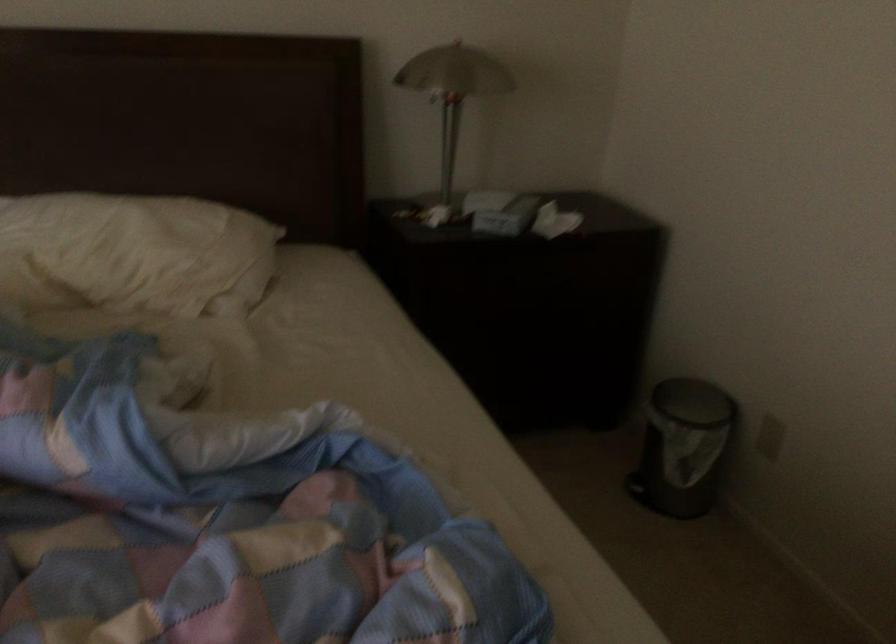
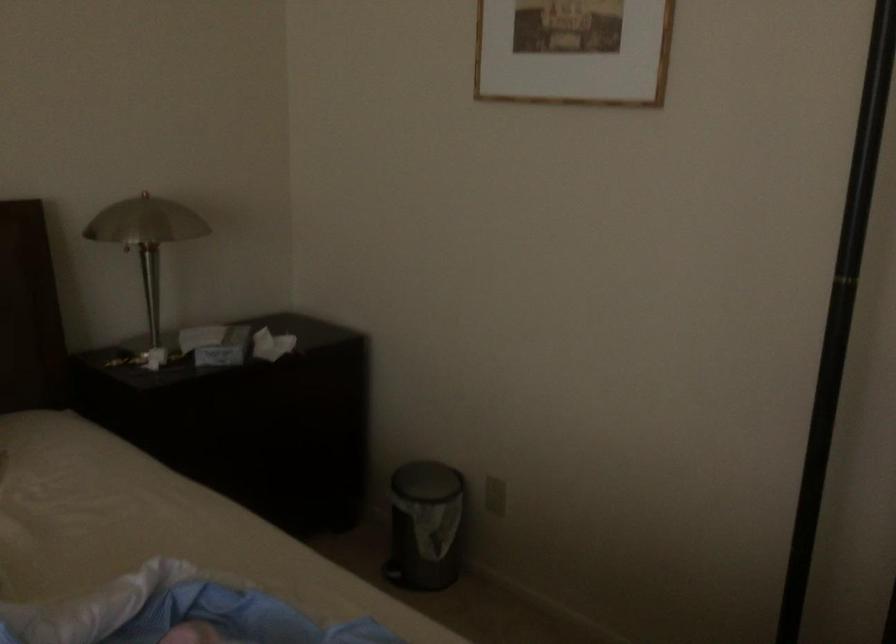
Question: The camera is either moving clockwise (left) or counter-clockwise (right) around the object. The first image is from the beginning of the video and the second image is from the end. Is the camera moving left or right when shooting the video?

Choices:
 (A) Left
 (B) Right

Answer: (A)